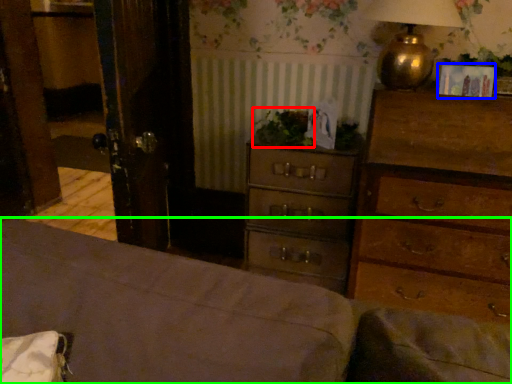
Question: Estimate the real-world distances between objects in this image. Which object is closer to plant (highlighted by a red box), picture frame (highlighted by a blue box) or bed frame (highlighted by a green box)?

Choices:
 (A) picture frame
 (B) bed frame

Answer: (A)